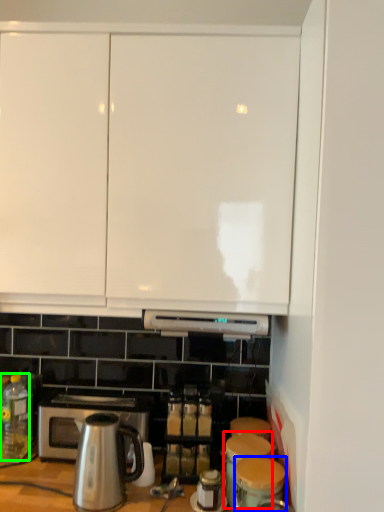
Question: Considering the real-world distances, which object is closest to appliance (highlighted by a red box)? appliance (highlighted by a blue box) or bottle (highlighted by a green box).

Choices:
 (A) appliance
 (B) bottle

Answer: (A)